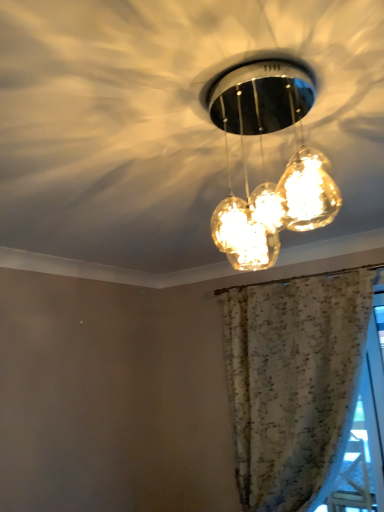
Question: Can you confirm if floral fabric curtain at upper center is smaller than translucent glass pendant lights at center?

Choices:
 (A) no
 (B) yes

Answer: (A)

Question: Would you say floral fabric curtain at upper center contains translucent glass pendant lights at center?

Choices:
 (A) no
 (B) yes

Answer: (A)

Question: From the image's perspective, is floral fabric curtain at upper center below translucent glass pendant lights at center?

Choices:
 (A) no
 (B) yes

Answer: (B)

Question: Is floral fabric curtain at upper center facing away from translucent glass pendant lights at center?

Choices:
 (A) yes
 (B) no

Answer: (B)

Question: Considering the relative sizes of floral fabric curtain at upper center and translucent glass pendant lights at center in the image provided, is floral fabric curtain at upper center bigger than translucent glass pendant lights at center?

Choices:
 (A) yes
 (B) no

Answer: (A)

Question: From the image's perspective, is floral fabric curtain at upper center above translucent glass pendant lights at center?

Choices:
 (A) no
 (B) yes

Answer: (A)

Question: Does translucent glass pendant lights at center appear on the left side of floral fabric curtain at upper center?

Choices:
 (A) no
 (B) yes

Answer: (B)

Question: Is translucent glass pendant lights at center at the right side of floral fabric curtain at upper center?

Choices:
 (A) no
 (B) yes

Answer: (A)

Question: Is floral fabric curtain at upper center surrounded by translucent glass pendant lights at center?

Choices:
 (A) no
 (B) yes

Answer: (A)

Question: Is translucent glass pendant lights at center oriented towards floral fabric curtain at upper center?

Choices:
 (A) no
 (B) yes

Answer: (A)

Question: Is translucent glass pendant lights at center positioned far away from floral fabric curtain at upper center?

Choices:
 (A) yes
 (B) no

Answer: (A)

Question: Is translucent glass pendant lights at center directly adjacent to floral fabric curtain at upper center?

Choices:
 (A) yes
 (B) no

Answer: (B)

Question: Considering the positions of floral fabric curtain at upper center and translucent glass pendant lights at center in the image, is floral fabric curtain at upper center taller or shorter than translucent glass pendant lights at center?

Choices:
 (A) short
 (B) tall

Answer: (B)